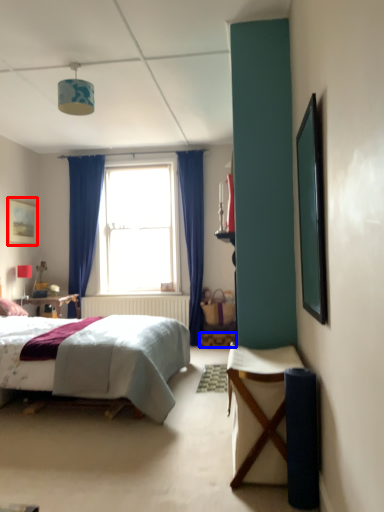
Question: Which point is further to the camera, picture frame (highlighted by a red box) or stool (highlighted by a blue box)?

Choices:
 (A) picture frame
 (B) stool

Answer: (B)